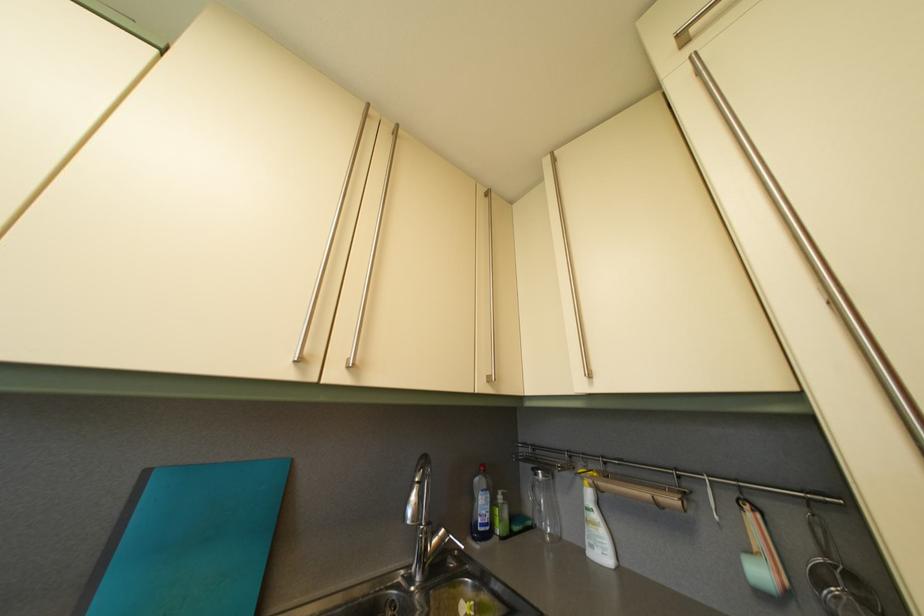
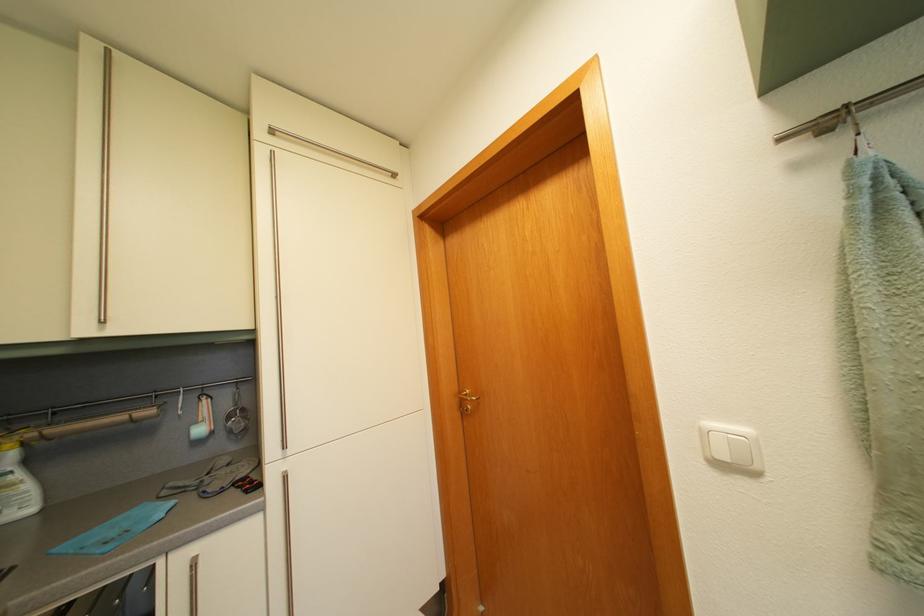
Find the pixel in the second image that matches (x=758, y=559) in the first image.

(204, 430)